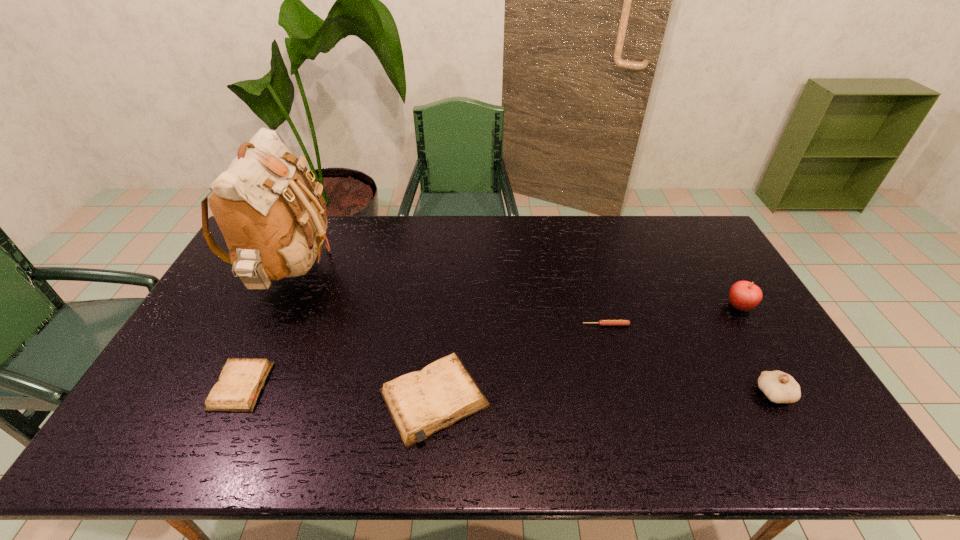
The diarys are evenly distributed in the image. To maintain this, where would you place another diary on the right? Please point to a free space. Please provide its 2D coordinates. Your answer should be formatted as a tuple, i.e. [(x, y)], where the tuple contains the x and y coordinates of a point satisfying the conditions above.

[(637, 412)]